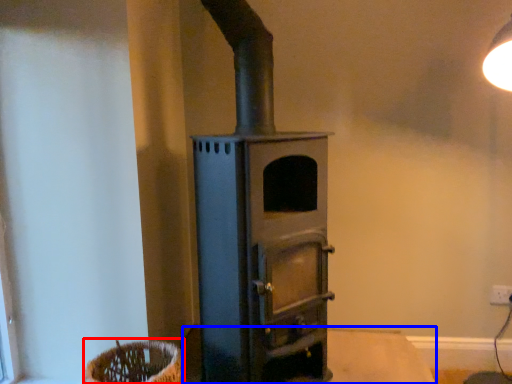
Question: Which object appears closest to the camera in this image, basket (highlighted by a red box) or table (highlighted by a blue box)?

Choices:
 (A) basket
 (B) table

Answer: (A)